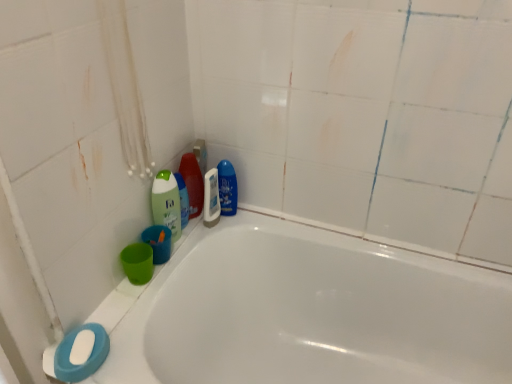
Where is `vacant space in front of white glossy mouthwash at center`? The height and width of the screenshot is (384, 512). vacant space in front of white glossy mouthwash at center is located at coordinates (195, 249).